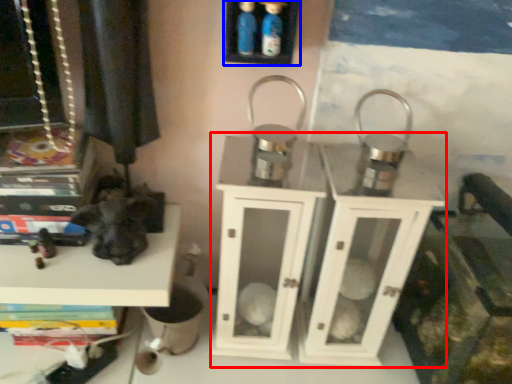
Question: Among these objects, which one is nearest to the camera, dresser (highlighted by a red box) or shelf (highlighted by a blue box)?

Choices:
 (A) dresser
 (B) shelf

Answer: (B)